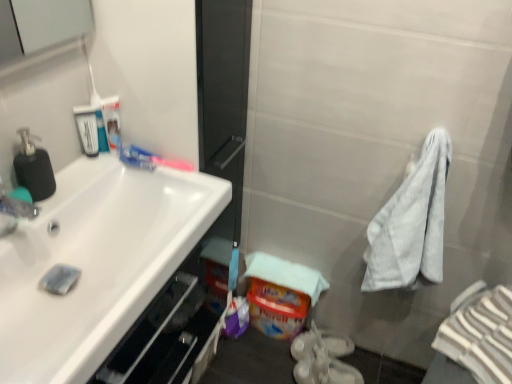
Image resolution: width=512 pixels, height=384 pixels. What do you see at coordinates (475, 338) in the screenshot? I see `white striped bath towel at right` at bounding box center [475, 338].

In order to face clear plastic bottle at upper left, which is the first mouthwash from right to left, should I rotate leftwards or rightwards?

Turn left approximately 18.620 degrees to face it.

What do you see at coordinates (112, 121) in the screenshot? This screenshot has width=512, height=384. I see `clear plastic bottle at upper left, marked as the second mouthwash in a left-to-right arrangement` at bounding box center [112, 121].

Identify the location of white plastic mouthwash at upper left, marked as the 2th mouthwash in a right-to-left arrangement. (87, 129).

What do you see at coordinates (87, 129) in the screenshot?
I see `white plastic mouthwash at upper left, acting as the 1th mouthwash starting from the left` at bounding box center [87, 129].

Find the location of a particular element. white glossy toothpaste at upper left is located at coordinates (150, 159).

In the scene shown: Which point is more forward, [40,156] or [467,299]?

Point [40,156]

Is matte black soap dispenser at left looking in the opposite direction of white striped bath towel at right?

No.

Looking at the image, does matte black soap dispenser at left seem bigger or smaller compared to white striped bath towel at right?

Clearly, matte black soap dispenser at left is smaller in size than white striped bath towel at right.

Which is correct: clear plastic bottle at upper left, marked as the second mouthwash in a left-to-right arrangement, is inside matte black soap dispenser at left, or outside of it?

The correct answer is: outside.

Would you consider clear plastic bottle at upper left, which is the first mouthwash from right to left, to be distant from matte black soap dispenser at left?

They are positioned close to each other.

Which object is positioned more to the left, clear plastic bottle at upper left, marked as the second mouthwash in a left-to-right arrangement, or matte black soap dispenser at left?

From the viewer's perspective, matte black soap dispenser at left appears more on the left side.

Looking at this image, how much distance is there between clear plastic bottle at upper left, which is the first mouthwash from right to left, and matte black soap dispenser at left?

A distance of 9.07 inches exists between clear plastic bottle at upper left, which is the first mouthwash from right to left, and matte black soap dispenser at left.

In terms of width, does clear plastic bottle at upper left, marked as the second mouthwash in a left-to-right arrangement, look wider or thinner when compared to white striped bath towel at right?

In the image, clear plastic bottle at upper left, marked as the second mouthwash in a left-to-right arrangement, appears to be more narrow than white striped bath towel at right.

From a real-world perspective, relative to white striped bath towel at right, is clear plastic bottle at upper left, which is the first mouthwash from right to left, vertically above or below?

clear plastic bottle at upper left, which is the first mouthwash from right to left, is above white striped bath towel at right.

Could you tell me if clear plastic bottle at upper left, marked as the second mouthwash in a left-to-right arrangement, is facing white striped bath towel at right?

No, clear plastic bottle at upper left, marked as the second mouthwash in a left-to-right arrangement, is not oriented towards white striped bath towel at right.

Considering the relative positions of clear plastic bottle at upper left, marked as the second mouthwash in a left-to-right arrangement, and white striped bath towel at right in the image provided, is clear plastic bottle at upper left, marked as the second mouthwash in a left-to-right arrangement, to the left or to the right of white striped bath towel at right?

Clearly, clear plastic bottle at upper left, marked as the second mouthwash in a left-to-right arrangement, is on the left of white striped bath towel at right in the image.

From a real-world perspective, is white glossy toothpaste at upper left on white plastic mouthwash at upper left, acting as the 1th mouthwash starting from the left?

No.

Which of these two, white glossy toothpaste at upper left or white plastic mouthwash at upper left, acting as the 1th mouthwash starting from the left, stands shorter?

white glossy toothpaste at upper left is shorter.

Is white glossy toothpaste at upper left inside the boundaries of white plastic mouthwash at upper left, marked as the 2th mouthwash in a right-to-left arrangement, or outside?

white glossy toothpaste at upper left cannot be found inside white plastic mouthwash at upper left, marked as the 2th mouthwash in a right-to-left arrangement.

Is white plastic mouthwash at upper left, acting as the 1th mouthwash starting from the left, oriented away from white glossy toothpaste at upper left?

That's not correct — white plastic mouthwash at upper left, acting as the 1th mouthwash starting from the left, is not looking away from white glossy toothpaste at upper left.

How different are the orientations of white plastic mouthwash at upper left, marked as the 2th mouthwash in a right-to-left arrangement, and white glossy toothpaste at upper left in degrees?

white plastic mouthwash at upper left, marked as the 2th mouthwash in a right-to-left arrangement, and white glossy toothpaste at upper left are facing 64.5 degrees away from each other.

From a real-world perspective, between white plastic mouthwash at upper left, marked as the 2th mouthwash in a right-to-left arrangement, and white glossy toothpaste at upper left, who is vertically lower?

white glossy toothpaste at upper left is physically lower.

Which object is positioned more to the right, white plastic mouthwash at upper left, acting as the 1th mouthwash starting from the left, or white glossy toothpaste at upper left?

Positioned to the right is white glossy toothpaste at upper left.

Which object is wider, matte black soap dispenser at left or clear plastic bottle at upper left, which is the first mouthwash from right to left?

Wider between the two is matte black soap dispenser at left.

From a real-world perspective, is matte black soap dispenser at left below clear plastic bottle at upper left, which is the first mouthwash from right to left?

No.

From the image's perspective, relative to clear plastic bottle at upper left, marked as the second mouthwash in a left-to-right arrangement, is matte black soap dispenser at left above or below?

Clearly, from the image's perspective, matte black soap dispenser at left is below clear plastic bottle at upper left, marked as the second mouthwash in a left-to-right arrangement.

You are a GUI agent. You are given a task and a screenshot of the screen. Output one action in this format:
    pyautogui.click(x=<x>, y=<y>)
    Task: Click on the soap dispenser located above the clear plastic bottle at upper left, which is the first mouthwash from right to left (from a real-world perspective)
    
    Given the screenshot: What is the action you would take?
    pyautogui.click(x=34, y=167)

In order to click on toothpaste that is above the matte black soap dispenser at left (from the image's perspective) in this screenshot , I will do `click(150, 159)`.

Considering their positions, is white glossy toothpaste at upper left located in front of or behind matte black soap dispenser at left?

In the image, white glossy toothpaste at upper left appears behind matte black soap dispenser at left.

Where is `soap dispenser above the white striped bath towel at right (from the image's perspective)`? The image size is (512, 384). soap dispenser above the white striped bath towel at right (from the image's perspective) is located at coordinates (34, 167).

This screenshot has width=512, height=384. I want to click on soap dispenser in front of the clear plastic bottle at upper left, which is the first mouthwash from right to left, so click(34, 167).

Consider the image. Based on their spatial positions, is clear plastic bottle at upper left, marked as the second mouthwash in a left-to-right arrangement, or matte black soap dispenser at left further from white plastic mouthwash at upper left, acting as the 1th mouthwash starting from the left?

The object further to white plastic mouthwash at upper left, acting as the 1th mouthwash starting from the left, is matte black soap dispenser at left.

Considering their positions, is white striped bath towel at right positioned closer to white plastic mouthwash at upper left, acting as the 1th mouthwash starting from the left, than white glossy toothpaste at upper left?

white glossy toothpaste at upper left is closer to white plastic mouthwash at upper left, acting as the 1th mouthwash starting from the left.

Looking at the image, which one is located closer to white striped bath towel at right, white glossy sink at left or matte black soap dispenser at left?

white glossy sink at left is positioned closer to the anchor white striped bath towel at right.

From the image, which object appears to be nearer to white striped bath towel at right, white glossy toothpaste at upper left or matte black soap dispenser at left?

white glossy toothpaste at upper left.

Looking at the image, which one is located further to matte black soap dispenser at left, clear plastic bottle at upper left, marked as the second mouthwash in a left-to-right arrangement, or white glossy sink at left?

white glossy sink at left is further to matte black soap dispenser at left.

Based on their spatial positions, is matte black soap dispenser at left or white glossy toothpaste at upper left further from white striped bath towel at right?

matte black soap dispenser at left.

Estimate the real-world distances between objects in this image. Which object is further from white plastic mouthwash at upper left, marked as the 2th mouthwash in a right-to-left arrangement, white striped bath towel at right or white glossy sink at left?

The object further to white plastic mouthwash at upper left, marked as the 2th mouthwash in a right-to-left arrangement, is white striped bath towel at right.

Considering their positions, is white plastic mouthwash at upper left, marked as the 2th mouthwash in a right-to-left arrangement, positioned further to matte black soap dispenser at left than clear plastic bottle at upper left, marked as the second mouthwash in a left-to-right arrangement?

clear plastic bottle at upper left, marked as the second mouthwash in a left-to-right arrangement, is further to matte black soap dispenser at left.

Identify the location of mouthwash between white plastic mouthwash at upper left, acting as the 1th mouthwash starting from the left, and white glossy toothpaste at upper left from left to right. The width and height of the screenshot is (512, 384). (112, 121).

Identify the location of sink situated between white plastic mouthwash at upper left, acting as the 1th mouthwash starting from the left, and white striped bath towel at right from left to right. Image resolution: width=512 pixels, height=384 pixels. pos(96,263).

Locate an element on the screen. The image size is (512, 384). toothpaste situated between matte black soap dispenser at left and white striped bath towel at right from left to right is located at coordinates click(150, 159).

Identify the location of soap dispenser between white glossy sink at left and white plastic mouthwash at upper left, acting as the 1th mouthwash starting from the left, from front to back. (34, 167).